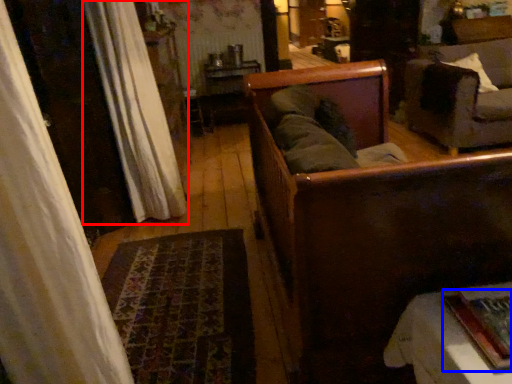
Question: Which point is closer to the camera, curtain (highlighted by a red box) or book (highlighted by a blue box)?

Choices:
 (A) curtain
 (B) book

Answer: (B)